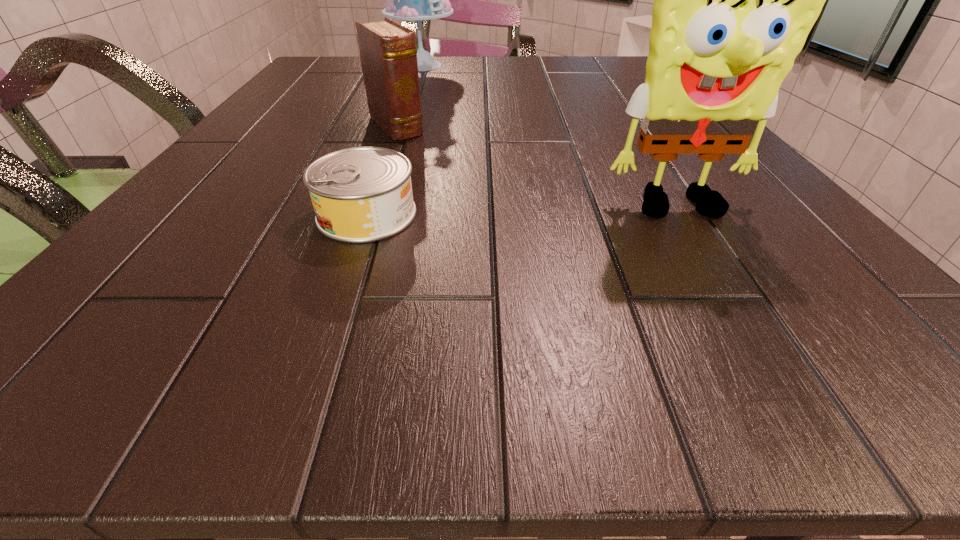
Where is `the shortest object`? The width and height of the screenshot is (960, 540). the shortest object is located at coordinates (363, 194).

Where is `the second tallest object`? the second tallest object is located at coordinates (734, 0).

What are the coordinates of `the rightmost object` in the screenshot? It's located at (734, 0).

What are the coordinates of `the third tallest object` in the screenshot? It's located at (388, 53).

Locate an element on the screen. This screenshot has height=540, width=960. the third nearest object is located at coordinates (388, 53).

In order to click on cake in this screenshot , I will do `click(417, 0)`.

Where is `the farthest object`? the farthest object is located at coordinates (417, 0).

At what (x,y) coordinates should I click in order to perform the action: click on vacant space positioned 0.210m on the left of the can. Please return your answer as a coordinate pair (x, y). The height and width of the screenshot is (540, 960). Looking at the image, I should click on 170,214.

I want to click on vacant space located on the face of the third shortest object, so click(x=717, y=268).

Locate an element on the screen. Image resolution: width=960 pixels, height=540 pixels. vacant space located 0.150m on the spine side of the third tallest object is located at coordinates (444, 173).